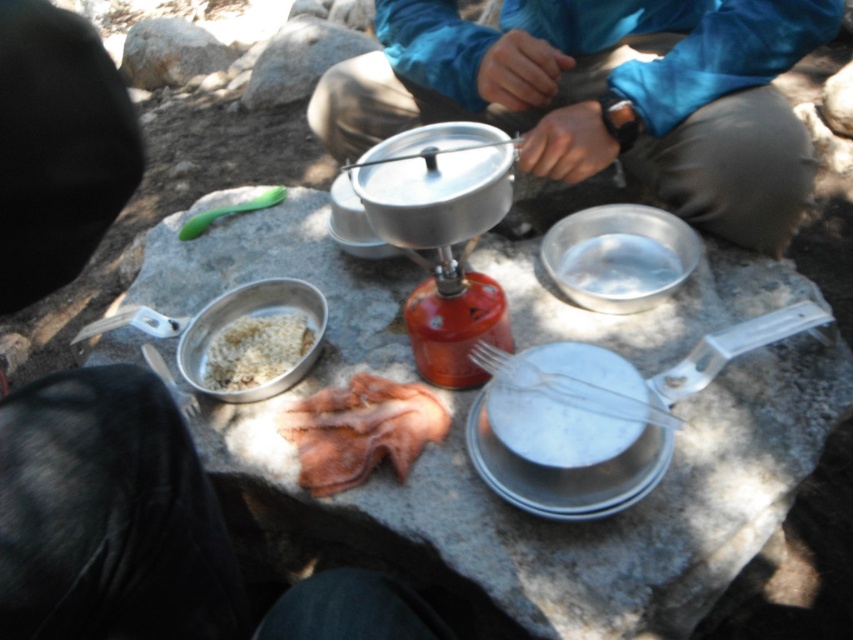
You are standing at point (340,160) and want to take a photo of the entire campsite setup. If your camera is 1.85 meters away from this point, will the camera be able to capture the entire scene in one shot?

The camera is 1.85 meters away from point (340,160), so yes, the camera can capture the entire scene in one shot since it is positioned at the correct distance.

You are setting up a camp kitchen and need to access the white matte rice at center left. Is the brushed metal cooking set at center blocking your direct path to it?

The brushed metal cooking set at center is in front of white matte rice at center left, so it is blocking the direct path to the rice.